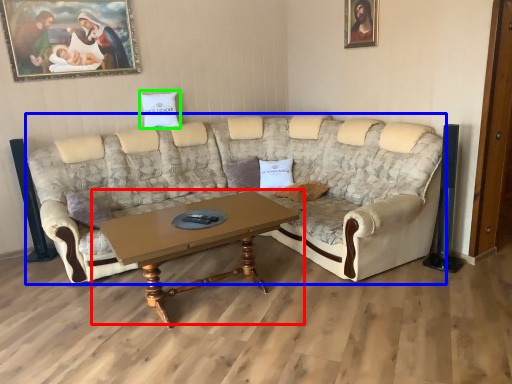
Question: Considering the real-world distances, which object is farthest from coffee table (highlighted by a red box)? studio couch (highlighted by a blue box) or pillow (highlighted by a green box)?

Choices:
 (A) studio couch
 (B) pillow

Answer: (B)